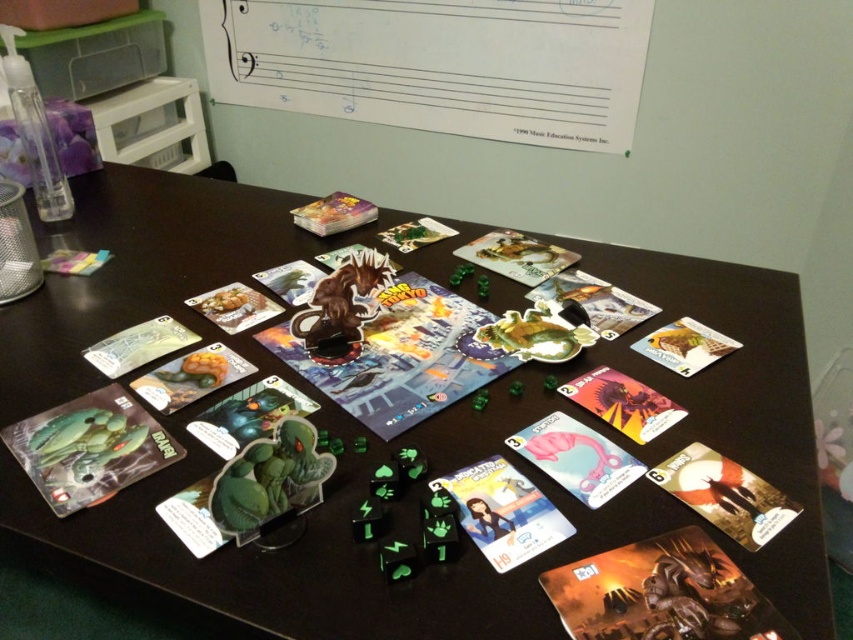
Question: Is black plastic table at center closer to camera compared to matte plastic postcard at center?

Choices:
 (A) no
 (B) yes

Answer: (B)

Question: Does black plastic table at center appear over matte plastic postcard at center?

Choices:
 (A) no
 (B) yes

Answer: (B)

Question: Among these points, which one is farthest from the camera?

Choices:
 (A) (503, 300)
 (B) (483, 520)

Answer: (A)

Question: Which point appears farthest from the camera in this image?

Choices:
 (A) (154, 529)
 (B) (505, 534)

Answer: (A)

Question: Is black plastic table at center to the left of matte plastic postcard at center from the viewer's perspective?

Choices:
 (A) no
 (B) yes

Answer: (B)